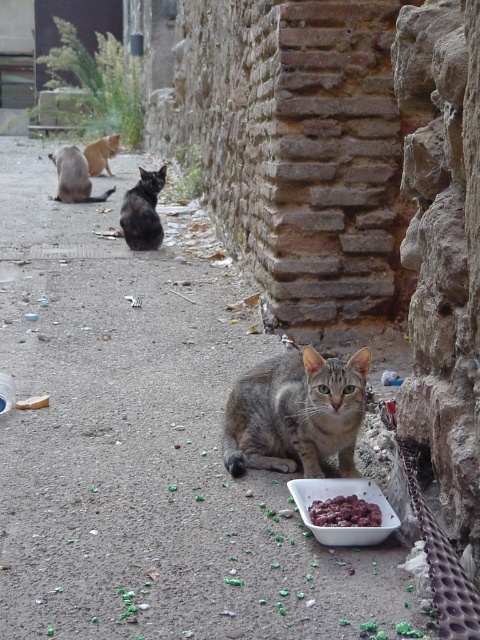
Is point (74, 364) positioned behind point (275, 371)?

That is True.

Does striped fur cat at center appear on the left side of tabby fur cat at center?

No, striped fur cat at center is not to the left of tabby fur cat at center.

This screenshot has height=640, width=480. Describe the element at coordinates (145, 451) in the screenshot. I see `striped fur cat at center` at that location.

I want to click on striped fur cat at center, so click(145, 451).

Is tabby fur cat at center wider than white plastic bowl at lower center?

Yes.

Between tabby fur cat at center and white plastic bowl at lower center, which one has less height?

white plastic bowl at lower center

Describe the element at coordinates (296, 413) in the screenshot. This screenshot has height=640, width=480. I see `tabby fur cat at center` at that location.

You are a GUI agent. You are given a task and a screenshot of the screen. Output one action in this format:
    pyautogui.click(x=<x>, y=<y>)
    Task: Click on the tabby fur cat at center
    This screenshot has height=640, width=480.
    Given the screenshot: What is the action you would take?
    pyautogui.click(x=296, y=413)

Is point (142, 188) behind point (87, 147)?

No, it is not.

The width and height of the screenshot is (480, 640). Describe the element at coordinates (143, 211) in the screenshot. I see `black fur cat at center` at that location.

Is point (157, 193) behind point (93, 152)?

No, it is not.

The height and width of the screenshot is (640, 480). Find the location of `black fur cat at center`. black fur cat at center is located at coordinates (143, 211).